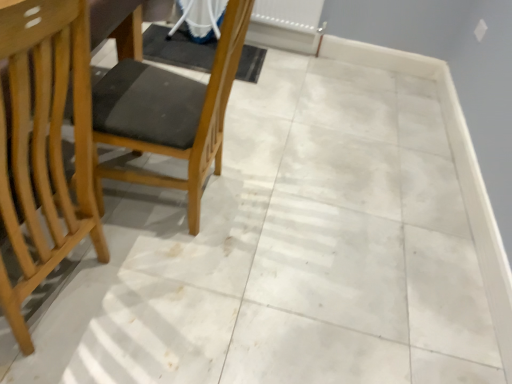
Question: Is wooden chair at left, positioned as the 1th chair in right-to-left order, at the left side of light wood chair at left, which is the second chair from right to left?

Choices:
 (A) yes
 (B) no

Answer: (B)

Question: Is wooden chair at left, which appears as the 2th chair when viewed from the left, smaller than light wood chair at left, which is the second chair from right to left?

Choices:
 (A) no
 (B) yes

Answer: (B)

Question: From a real-world perspective, is wooden chair at left, positioned as the 1th chair in right-to-left order, under light wood chair at left, which is the second chair from right to left?

Choices:
 (A) no
 (B) yes

Answer: (B)

Question: Is wooden chair at left, which appears as the 2th chair when viewed from the left, surrounding light wood chair at left, which is the second chair from right to left?

Choices:
 (A) yes
 (B) no

Answer: (B)

Question: Is wooden chair at left, positioned as the 1th chair in right-to-left order, not close to light wood chair at left, which is the second chair from right to left?

Choices:
 (A) no
 (B) yes

Answer: (A)

Question: Is wooden chair at left, positioned as the 1th chair in right-to-left order, thinner than light wood chair at left, which is the second chair from right to left?

Choices:
 (A) yes
 (B) no

Answer: (A)

Question: Is light wood chair at left, which is the second chair from right to left, located outside white plastic radiator at upper center?

Choices:
 (A) yes
 (B) no

Answer: (A)

Question: Is light wood chair at left, which is the second chair from right to left, wider than white plastic radiator at upper center?

Choices:
 (A) no
 (B) yes

Answer: (B)

Question: Does light wood chair at left, which is the second chair from right to left, have a larger size compared to white plastic radiator at upper center?

Choices:
 (A) yes
 (B) no

Answer: (A)

Question: Is light wood chair at left, which is the second chair from right to left, shorter than white plastic radiator at upper center?

Choices:
 (A) yes
 (B) no

Answer: (B)

Question: Is the depth of light wood chair at left, which is counted as the first chair, starting from the left, less than that of white plastic radiator at upper center?

Choices:
 (A) no
 (B) yes

Answer: (B)

Question: Does light wood chair at left, which is counted as the first chair, starting from the left, appear on the left side of white plastic radiator at upper center?

Choices:
 (A) yes
 (B) no

Answer: (A)

Question: Considering the relative sizes of wooden chair at left, positioned as the 1th chair in right-to-left order, and white plastic radiator at upper center in the image provided, is wooden chair at left, positioned as the 1th chair in right-to-left order, smaller than white plastic radiator at upper center?

Choices:
 (A) no
 (B) yes

Answer: (A)